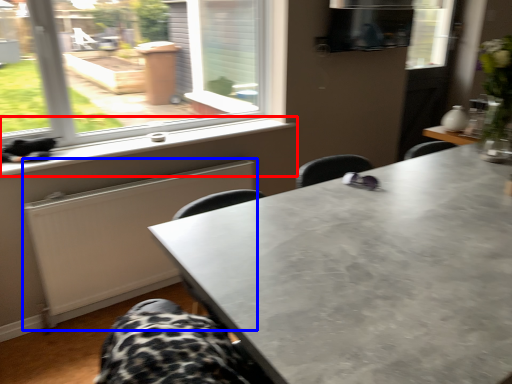
Question: Which object is closer to the camera taking this photo, window sill (highlighted by a red box) or radiator (highlighted by a blue box)?

Choices:
 (A) window sill
 (B) radiator

Answer: (A)